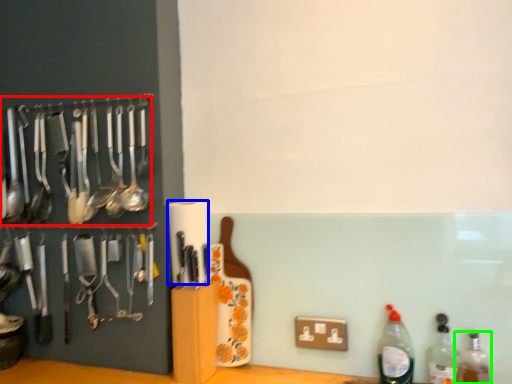
Question: Considering the real-world distances, which object is closest to spoon (highlighted by a red box)? paper towel (highlighted by a blue box) or bottle (highlighted by a green box).

Choices:
 (A) paper towel
 (B) bottle

Answer: (A)